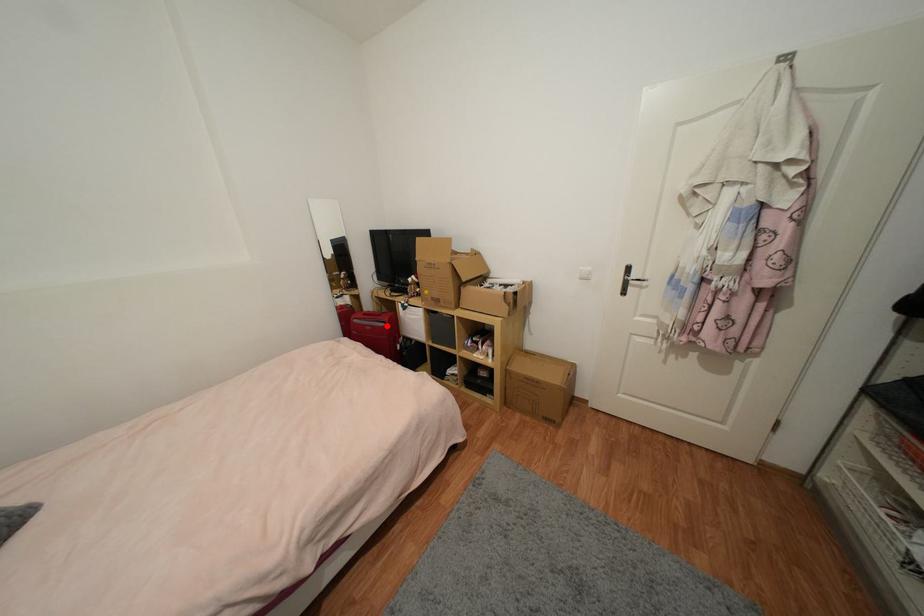
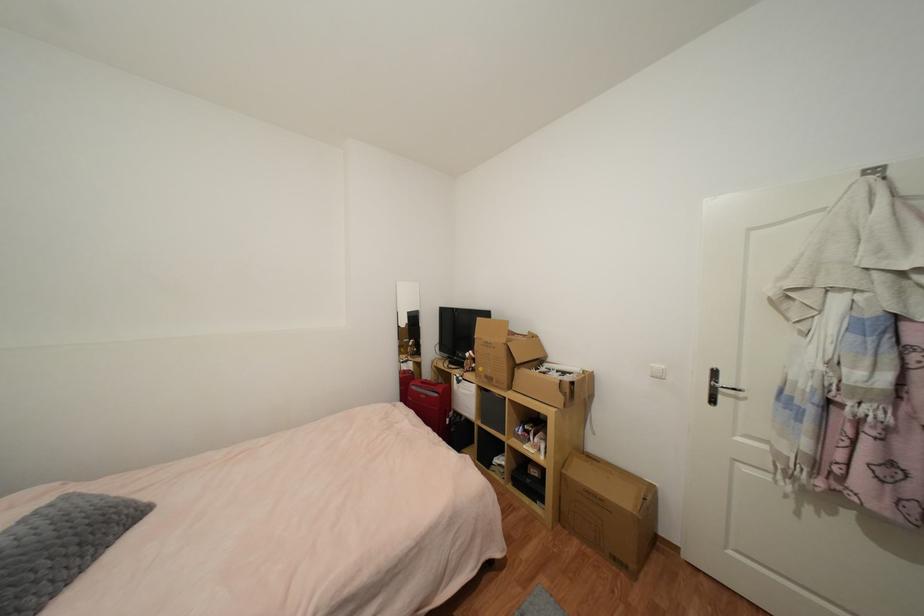
Question: I am providing you with two images of the same scene from different viewpoints. A red point is shown in image1. For the corresponding object point in image2, is it positioned nearer or farther from the camera?

Choices:
 (A) Nearer
 (B) Farther

Answer: (B)